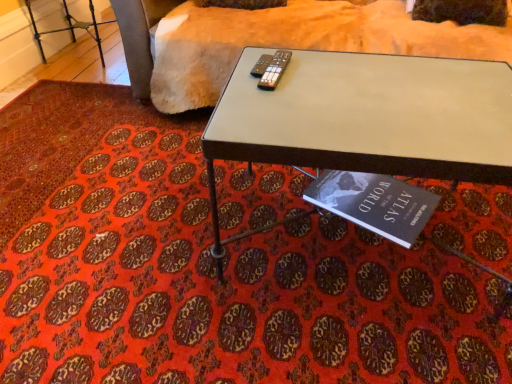
Question: Is metallic silver remote at center in front of or behind hardcover book at lower center in the image?

Choices:
 (A) front
 (B) behind

Answer: (A)

Question: Choose the correct answer: Is metallic silver remote at center inside hardcover book at lower center or outside it?

Choices:
 (A) inside
 (B) outside

Answer: (B)

Question: Which object is the closest to the hardcover book at lower center?

Choices:
 (A) metallic gray table at center
 (B) soft beige fabric at upper center
 (C) metallic silver remote at center

Answer: (A)

Question: Based on their relative distances, which object is nearer to the hardcover book at lower center?

Choices:
 (A) metallic silver remote at center
 (B) metallic gray table at center
 (C) soft beige fabric at upper center

Answer: (B)